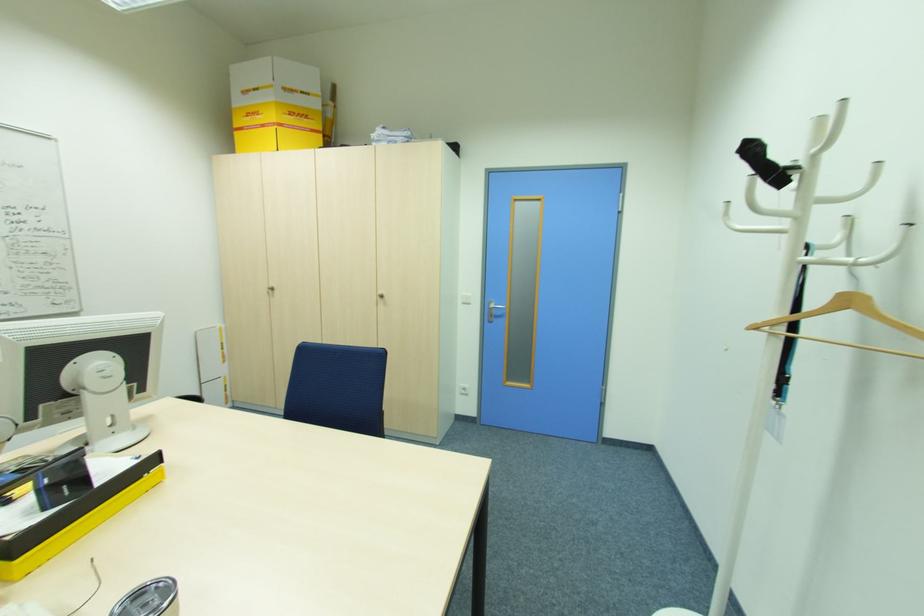
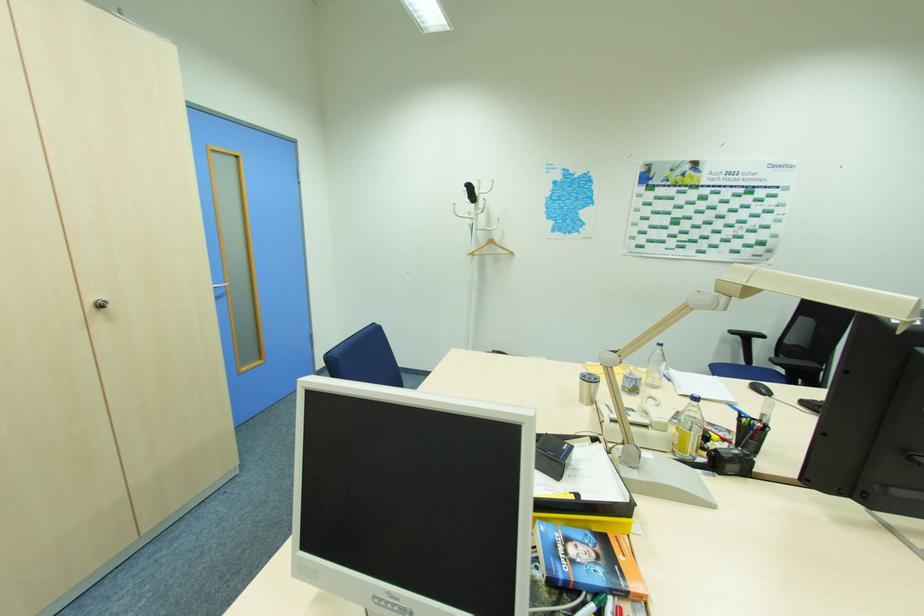
Find the pixel in the second image that matches [803,166] in the first image.

(479, 197)